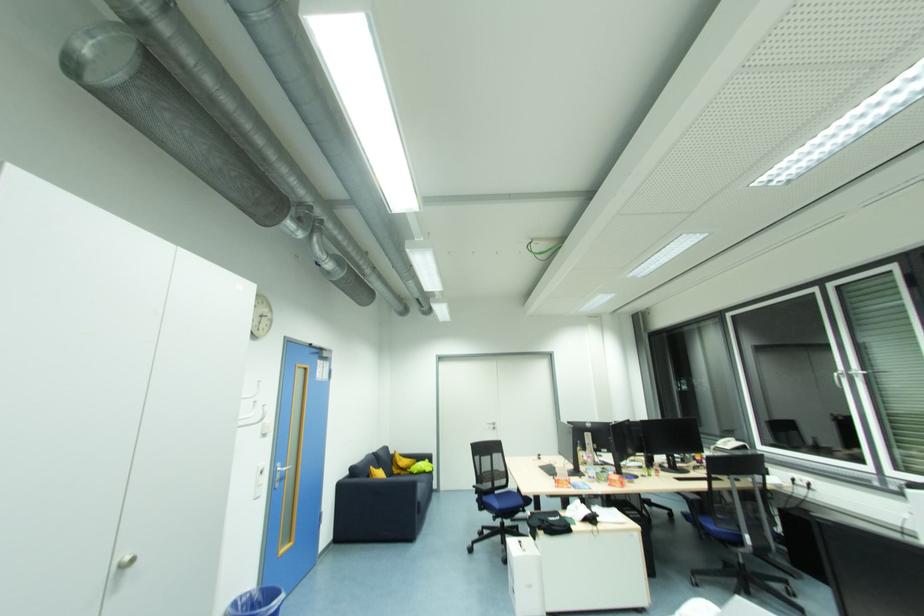
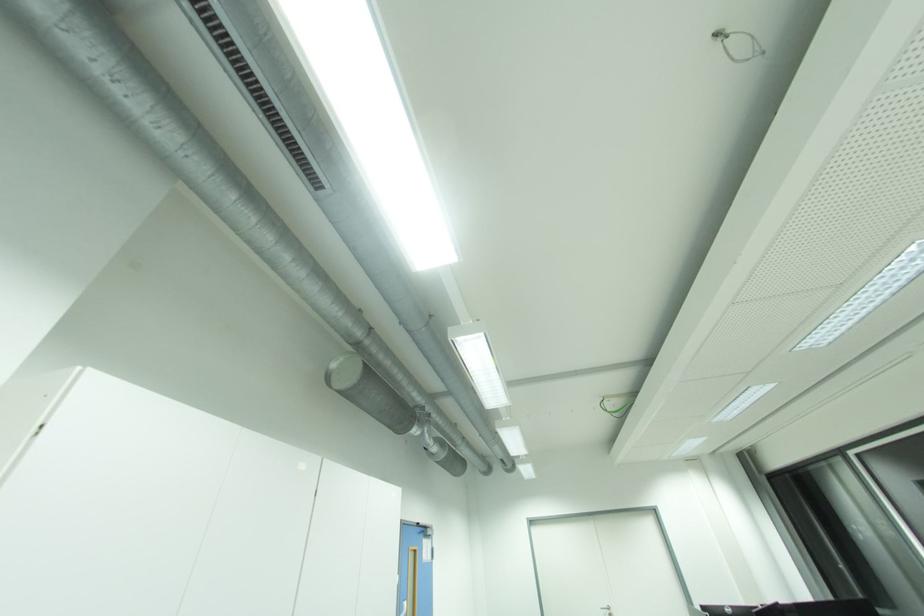
In the second image, find the point that corresponds to point 494,424 in the first image.

(610, 609)